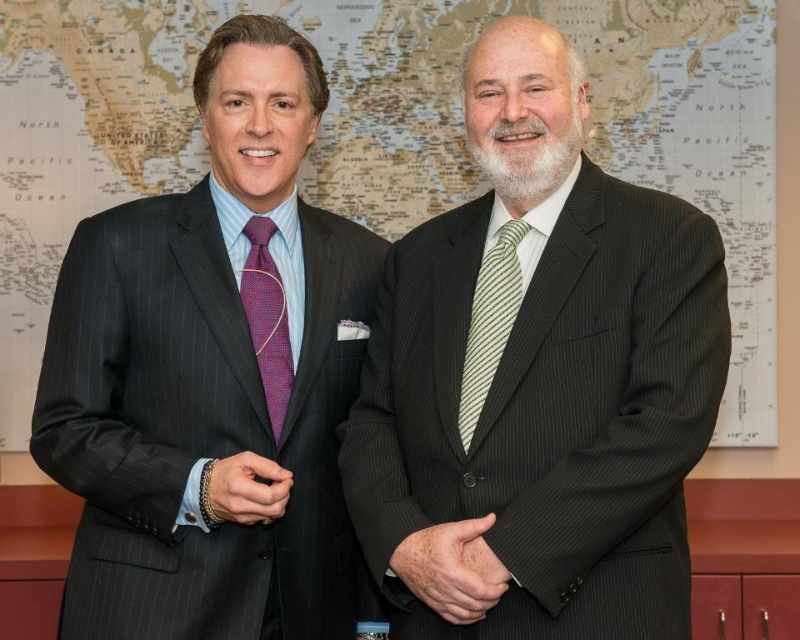
You are a photographer adjusting your camera to focus on two points in the image. The first point is point (366, 236) and the second is point (486, 316). Which point should you focus on first if you want to capture the closest object to the camera?

Point (366, 236) should be focused on first because it is closer to the camera than point (486, 316), as per the description.

You are a photographer setting up for a portrait. You notice the map paper at upper center and the purple woven tie at left in your frame. Which object is positioned to the right of the other?

The map paper at upper center is positioned to the right of the purple woven tie at left.

You are a photographer setting up for a portrait session. You notice the matte black suit at left and the striped silk tie at center in the frame. Which object is positioned further to the left in the image?

The matte black suit at left is positioned further to the left than the striped silk tie at center.